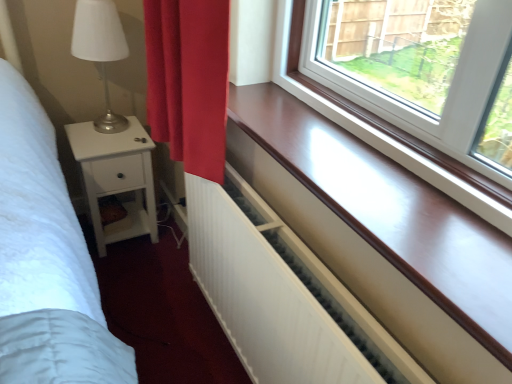
Question: Is white matte radiator at lower center surrounded by smooth wood window sill at center?

Choices:
 (A) no
 (B) yes

Answer: (A)

Question: Does smooth wood window sill at center have a smaller size compared to white matte radiator at lower center?

Choices:
 (A) yes
 (B) no

Answer: (A)

Question: Does smooth wood window sill at center have a greater height compared to white matte radiator at lower center?

Choices:
 (A) no
 (B) yes

Answer: (A)

Question: Is white matte radiator at lower center at the back of smooth wood window sill at center?

Choices:
 (A) no
 (B) yes

Answer: (A)

Question: Considering the relative sizes of smooth wood window sill at center and white matte radiator at lower center in the image provided, is smooth wood window sill at center wider than white matte radiator at lower center?

Choices:
 (A) no
 (B) yes

Answer: (B)

Question: From the image's perspective, is smooth wood window sill at center located above or below white wood nightstand at left?

Choices:
 (A) below
 (B) above

Answer: (B)

Question: Does point (324, 196) appear closer or farther from the camera than point (148, 205)?

Choices:
 (A) closer
 (B) farther

Answer: (A)

Question: Based on their positions, is smooth wood window sill at center located to the left or right of white wood nightstand at left?

Choices:
 (A) right
 (B) left

Answer: (A)

Question: Choose the correct answer: Is smooth wood window sill at center inside white wood nightstand at left or outside it?

Choices:
 (A) outside
 (B) inside

Answer: (A)

Question: Looking at the image, does white matte radiator at lower center seem bigger or smaller compared to white wood nightstand at left?

Choices:
 (A) big
 (B) small

Answer: (A)

Question: Is white matte radiator at lower center inside or outside of white wood nightstand at left?

Choices:
 (A) outside
 (B) inside

Answer: (A)

Question: From the image's perspective, is white matte radiator at lower center located above or below white wood nightstand at left?

Choices:
 (A) below
 (B) above

Answer: (A)

Question: Is white matte radiator at lower center in front of or behind white wood nightstand at left in the image?

Choices:
 (A) behind
 (B) front

Answer: (B)

Question: Does point (264, 233) appear closer or farther from the camera than point (475, 256)?

Choices:
 (A) farther
 (B) closer

Answer: (A)

Question: Visually, is white matte radiator at lower center positioned to the left or to the right of smooth wood window sill at center?

Choices:
 (A) right
 (B) left

Answer: (B)